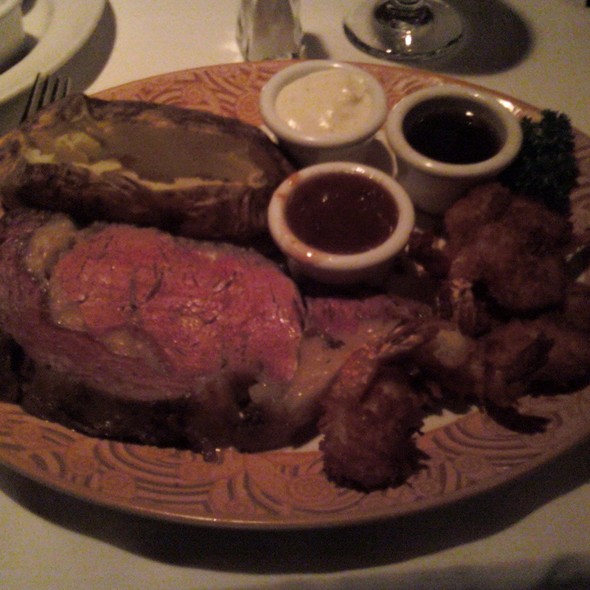
You are a GUI agent. You are given a task and a screenshot of the screen. Output one action in this format:
    pyautogui.click(x=<x>, y=<y>)
    Task: Click on the fork
    This screenshot has height=590, width=590.
    Given the screenshot: What is the action you would take?
    pyautogui.click(x=42, y=91)